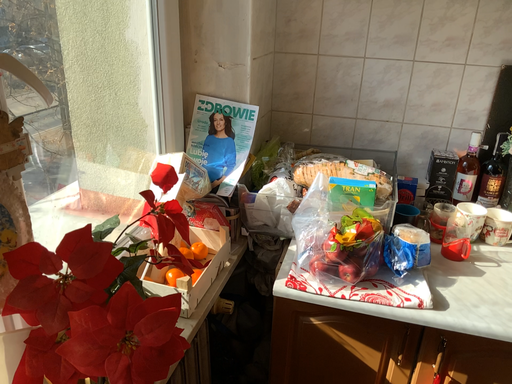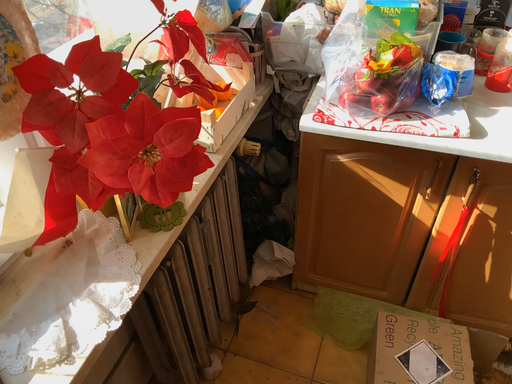
Question: Which way did the camera rotate in the video?

Choices:
 (A) rotated downward
 (B) rotated upward

Answer: (A)